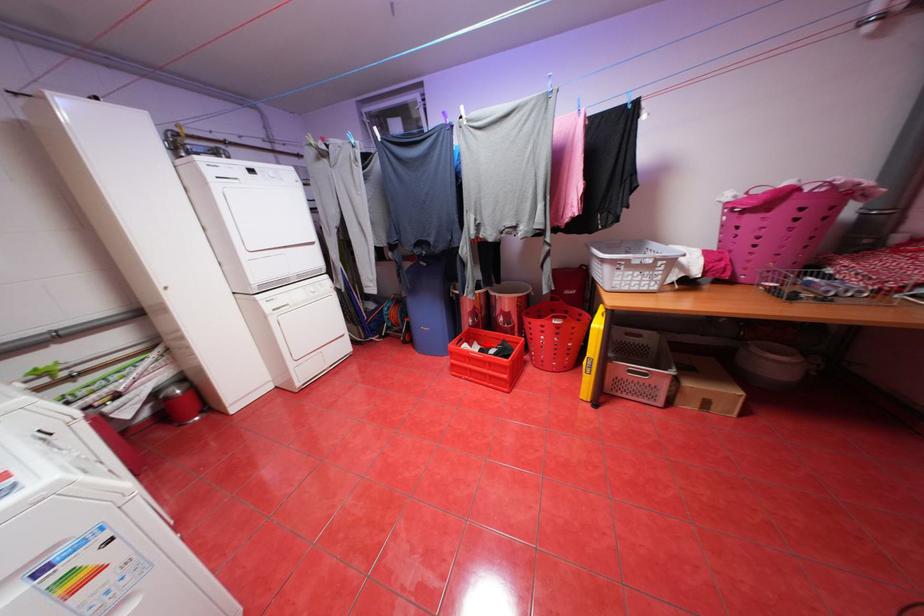
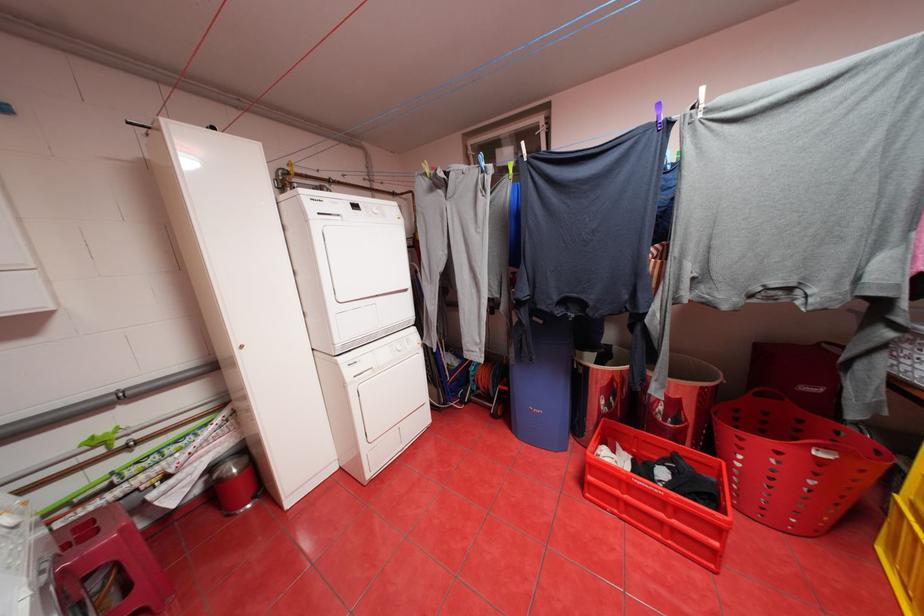
Question: I am providing you with two images of the same scene from different viewpoints. Image1 has a red point marked. In image2, the corresponding 3D location appears at what relative position? Reply with the corresponding letter.

Choices:
 (A) Closer
 (B) Farther

Answer: (B)